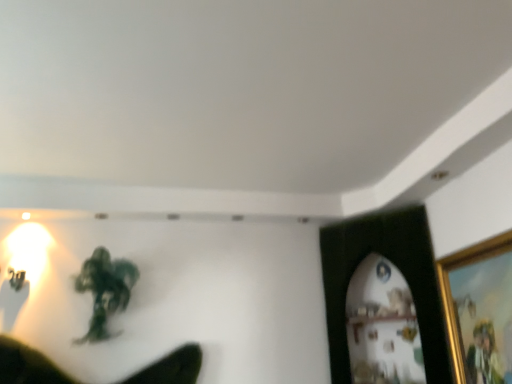
Question: In terms of size, does gold-framed picture at right, which is the first picture frame from front to back, appear bigger or smaller than black matte picture frame at upper right, the first picture frame positioned from the back?

Choices:
 (A) small
 (B) big

Answer: (A)

Question: In terms of width, does gold-framed picture at right, marked as the second picture frame in a back-to-front arrangement, look wider or thinner when compared to black matte picture frame at upper right, which appears as the 2th picture frame when viewed from the front?

Choices:
 (A) thin
 (B) wide

Answer: (A)

Question: Considering the real-world distances, which object is closest to the black matte picture frame at upper right, which appears as the 2th picture frame when viewed from the front?

Choices:
 (A) green matte figure at center
 (B) gold-framed picture at right, which is the first picture frame from front to back

Answer: (B)

Question: Which object is positioned farthest from the green matte figure at center?

Choices:
 (A) black matte picture frame at upper right, the first picture frame positioned from the back
 (B) gold-framed picture at right, which is the first picture frame from front to back

Answer: (B)